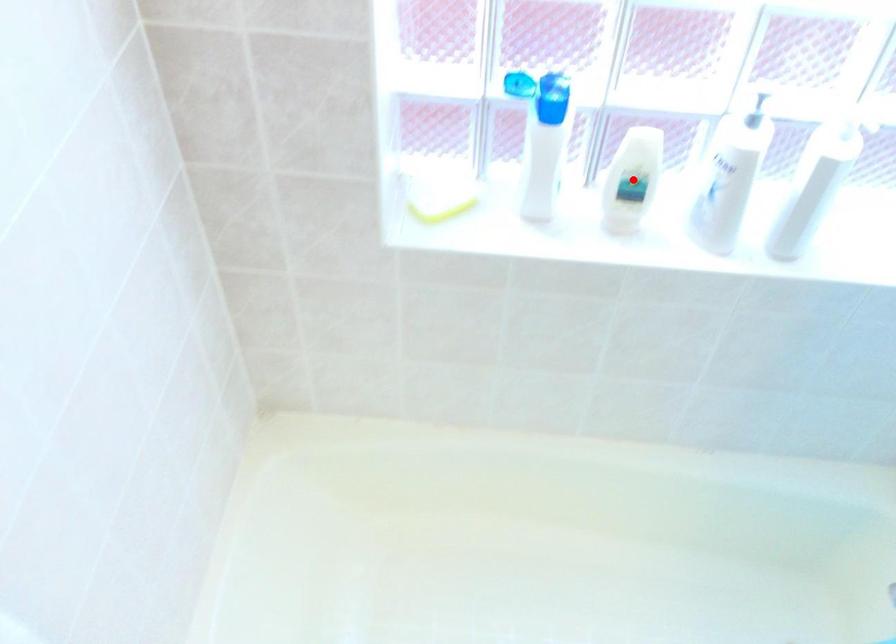
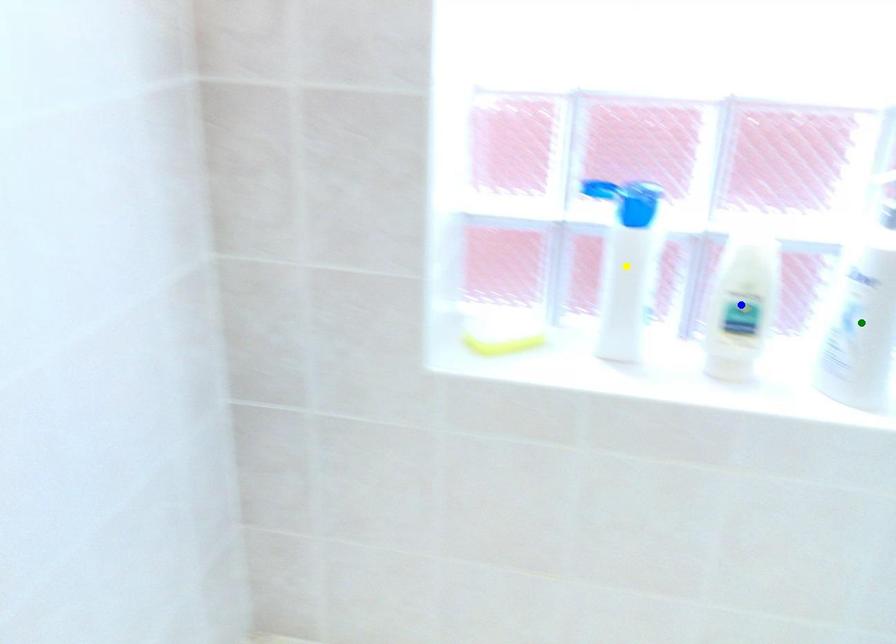
Question: I am providing you with two images of the same scene from different viewpoints. A red point is marked on the first image. You are given multiple points on the second image. Which spot in image 2 lines up with the point in image 1?

Choices:
 (A) blue point
 (B) yellow point
 (C) green point

Answer: (A)